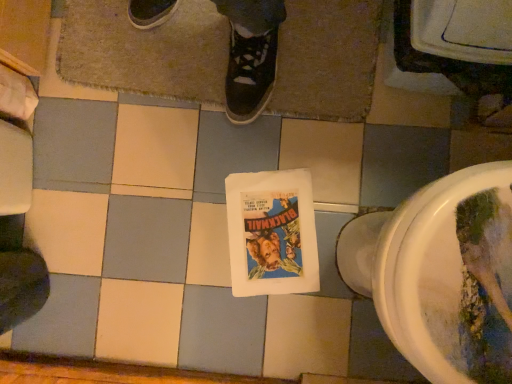
You are a GUI agent. You are given a task and a screenshot of the screen. Output one action in this format:
    pyautogui.click(x=<x>, y=<y>)
    Task: Click on the vacant region in front of matte paper comic book at center
    
    Given the screenshot: What is the action you would take?
    pyautogui.click(x=293, y=329)